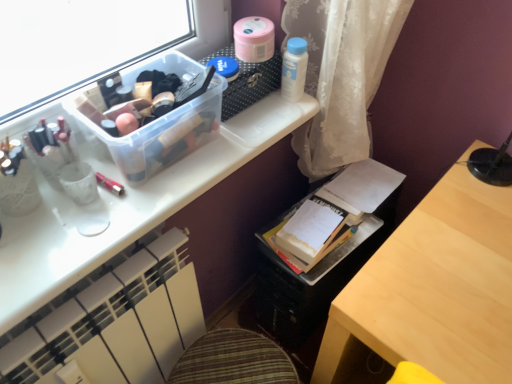
You are a GUI agent. You are given a task and a screenshot of the screen. Output one action in this format:
    pyautogui.click(x=<x>, y=<y>)
    Task: Click on the white paper book at center
    The width and height of the screenshot is (512, 384).
    Given the screenshot: What is the action you would take?
    pyautogui.click(x=334, y=213)

The height and width of the screenshot is (384, 512). Describe the element at coordinates (110, 184) in the screenshot. I see `metallic pink pen at upper left, the 1th toiletry in the left-to-right sequence` at that location.

Locate an element on the screen. The width and height of the screenshot is (512, 384). white paper book at center is located at coordinates (334, 213).

Looking at this image, between white paper book at center and white plastic bottle at upper right, acting as the 2th toiletry starting from the front, which one appears on the left side from the viewer's perspective?

Positioned to the left is white plastic bottle at upper right, acting as the 2th toiletry starting from the front.

From a real-world perspective, relative to white plastic bottle at upper right, which is the 1th toiletry in top-to-bottom order, is white paper book at center vertically above or below?

white paper book at center is situated lower than white plastic bottle at upper right, which is the 1th toiletry in top-to-bottom order, in the real world.

Is white paper book at center turned away from white plastic bottle at upper right, which is the 1th toiletry in top-to-bottom order?

white paper book at center is not turned away from white plastic bottle at upper right, which is the 1th toiletry in top-to-bottom order.

Which is in front, white paper book at center or matte white desk at upper center?

matte white desk at upper center is in front.

How many degrees apart are the facing directions of white paper book at center and matte white desk at upper center?

The angular difference between white paper book at center and matte white desk at upper center is 94.9 degrees.

From the image's perspective, is white paper book at center above matte white desk at upper center?

Incorrect, from the image's perspective, white paper book at center is lower than matte white desk at upper center.

Is white paper book at center oriented towards matte white desk at upper center?

No, white paper book at center is not oriented towards matte white desk at upper center.

Is point (100, 178) farther from camera compared to point (288, 72)?

No, (100, 178) is in front of (288, 72).

Is metallic pink pen at upper left, the first toiletry positioned from the bottom, next to white plastic bottle at upper right, acting as the 2th toiletry starting from the front?

No.

Is metallic pink pen at upper left, the 1th toiletry in the left-to-right sequence, positioned beyond the bounds of white plastic bottle at upper right, which is the first toiletry in back-to-front order?

Indeed, metallic pink pen at upper left, the 1th toiletry in the left-to-right sequence, is completely outside white plastic bottle at upper right, which is the first toiletry in back-to-front order.

How far apart are matte white desk at upper center and white plastic bottle at upper right, the 2th toiletry ordered from the bottom?

matte white desk at upper center and white plastic bottle at upper right, the 2th toiletry ordered from the bottom, are 13.28 inches apart from each other.

Could you tell me if matte white desk at upper center is turned towards white plastic bottle at upper right, the 2th toiletry ordered from the bottom?

No, matte white desk at upper center is not aimed at white plastic bottle at upper right, the 2th toiletry ordered from the bottom.

In order to click on desk that is in front of the white plastic bottle at upper right, which is counted as the first toiletry, starting from the right in this screenshot , I will do `click(126, 209)`.

Would you say matte white desk at upper center contains white plastic bottle at upper right, which is the 1th toiletry in top-to-bottom order?

No, white plastic bottle at upper right, which is the 1th toiletry in top-to-bottom order, is located outside of matte white desk at upper center.

I want to click on desk on the left of white plastic bottle at upper right, which is the first toiletry in back-to-front order, so click(x=126, y=209).

From the image's perspective, relative to matte white desk at upper center, is white plastic bottle at upper right, which is the first toiletry in back-to-front order, above or below?

Clearly, from the image's perspective, white plastic bottle at upper right, which is the first toiletry in back-to-front order, is above matte white desk at upper center.

Is white plastic bottle at upper right, the 2th toiletry when ordered from left to right, not close to matte white desk at upper center?

No, there isn't a large distance between white plastic bottle at upper right, the 2th toiletry when ordered from left to right, and matte white desk at upper center.

Which object is positioned more to the left, white plastic bottle at upper right, acting as the 2th toiletry starting from the front, or white paper book at center?

white plastic bottle at upper right, acting as the 2th toiletry starting from the front, is more to the left.

Which is behind, point (290, 81) or point (374, 206)?

The point (374, 206) is behind.

Looking at this image, which object is further away from the camera, white plastic bottle at upper right, which is the first toiletry in back-to-front order, or white paper book at center?

white paper book at center is more distant.

Locate an element on the screen. The image size is (512, 384). toiletry that is under the white plastic bottle at upper right, which is counted as the first toiletry, starting from the right (from a real-world perspective) is located at coordinates (110, 184).

Which point is more forward, (298, 79) or (115, 182)?

Positioned in front is point (115, 182).

Can you confirm if white plastic bottle at upper right, which is the first toiletry in back-to-front order, is bigger than metallic pink pen at upper left, the first toiletry positioned from the bottom?

Correct, white plastic bottle at upper right, which is the first toiletry in back-to-front order, is larger in size than metallic pink pen at upper left, the first toiletry positioned from the bottom.

Locate an element on the screen. This screenshot has height=384, width=512. book on the right of white plastic bottle at upper right, which is the first toiletry in back-to-front order is located at coordinates (334, 213).

Locate an element on the screen. This screenshot has width=512, height=384. book that is below the matte white desk at upper center (from the image's perspective) is located at coordinates (334, 213).

When comparing their distances from matte white desk at upper center, does white plastic bottle at upper right, the 2th toiletry when ordered from left to right, or metallic pink pen at upper left, the 2th toiletry viewed from the top, seem further?

Based on the image, white plastic bottle at upper right, the 2th toiletry when ordered from left to right, appears to be further to matte white desk at upper center.

In the scene shown: When comparing their distances from matte white desk at upper center, does white paper book at center or white plastic bottle at upper right, which is the 1th toiletry in top-to-bottom order, seem closer?

white paper book at center is positioned closer to the anchor matte white desk at upper center.

When comparing their distances from metallic pink pen at upper left, which appears as the first toiletry when viewed from the front, does matte white desk at upper center or white plastic bottle at upper right, the 2th toiletry ordered from the bottom, seem further?

white plastic bottle at upper right, the 2th toiletry ordered from the bottom.

Based on the photo, which object lies nearer to the anchor point metallic pink pen at upper left, which is counted as the 2th toiletry, starting from the back, white plastic bottle at upper right, which is the 1th toiletry in top-to-bottom order, or white paper book at center?

Among the two, white plastic bottle at upper right, which is the 1th toiletry in top-to-bottom order, is located nearer to metallic pink pen at upper left, which is counted as the 2th toiletry, starting from the back.

In the scene shown: Considering their positions, is metallic pink pen at upper left, which appears as the first toiletry when viewed from the front, positioned further to white plastic bottle at upper right, which is counted as the first toiletry, starting from the right, than white paper book at center?

metallic pink pen at upper left, which appears as the first toiletry when viewed from the front, lies further to white plastic bottle at upper right, which is counted as the first toiletry, starting from the right, than the other object.

Based on their spatial positions, is white plastic bottle at upper right, which is counted as the first toiletry, starting from the right, or white paper book at center closer to matte white desk at upper center?

white paper book at center is positioned closer to the anchor matte white desk at upper center.

From the image, which object appears to be farther from metallic pink pen at upper left, which appears as the first toiletry when viewed from the front, white paper book at center or white plastic bottle at upper right, the 2th toiletry when ordered from left to right?

The object further to metallic pink pen at upper left, which appears as the first toiletry when viewed from the front, is white paper book at center.

From the picture: When comparing their distances from white paper book at center, does white plastic bottle at upper right, acting as the 2th toiletry starting from the front, or matte white desk at upper center seem further?

Among the two, white plastic bottle at upper right, acting as the 2th toiletry starting from the front, is located further to white paper book at center.

Where is `desk located between metallic pink pen at upper left, which appears as the first toiletry when viewed from the front, and white plastic bottle at upper right, which is counted as the first toiletry, starting from the right, in the left-right direction`? The image size is (512, 384). desk located between metallic pink pen at upper left, which appears as the first toiletry when viewed from the front, and white plastic bottle at upper right, which is counted as the first toiletry, starting from the right, in the left-right direction is located at coordinates (126, 209).

You are a GUI agent. You are given a task and a screenshot of the screen. Output one action in this format:
    pyautogui.click(x=<x>, y=<y>)
    Task: Click on the toiletry situated between metallic pink pen at upper left, the 2th toiletry viewed from the top, and white paper book at center from left to right
    
    Given the screenshot: What is the action you would take?
    pyautogui.click(x=294, y=69)

The image size is (512, 384). Find the location of `desk between metallic pink pen at upper left, the second toiletry from the right, and white paper book at center from left to right`. desk between metallic pink pen at upper left, the second toiletry from the right, and white paper book at center from left to right is located at coordinates (126, 209).